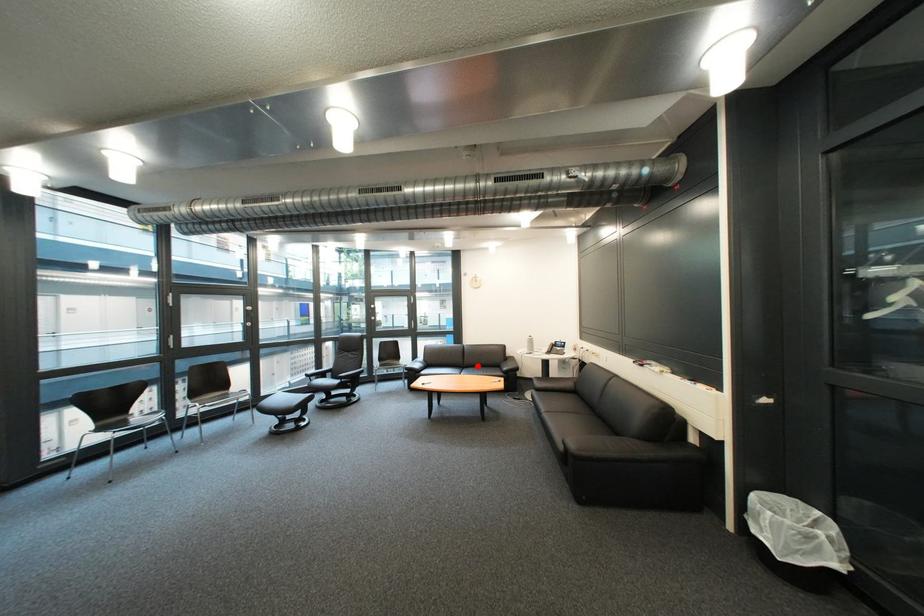
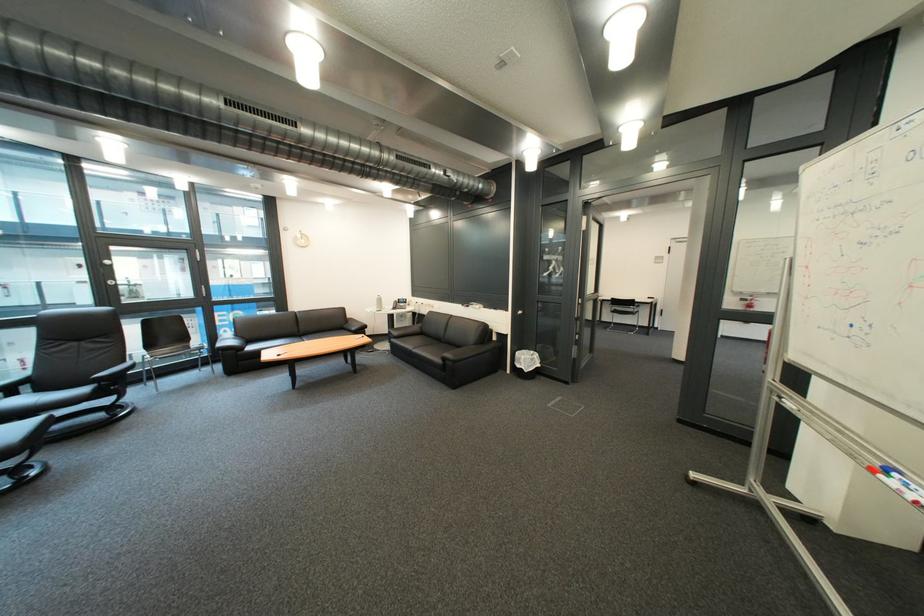
Locate, in the second image, the point that corresponds to the highlighted location in the first image.

(312, 334)